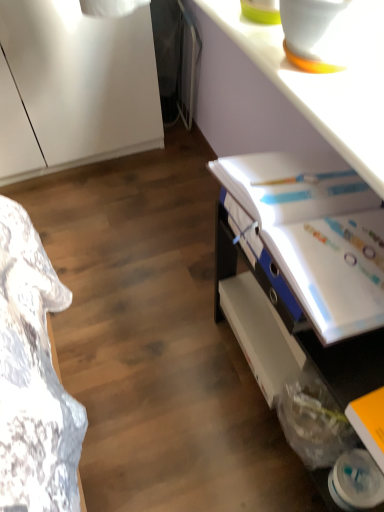
Question: From a real-world perspective, is white glossy binder at upper right, which is counted as the 2th book, starting from the front, physically below white glossy desk at lower right?

Choices:
 (A) no
 (B) yes

Answer: (A)

Question: Does white glossy binder at upper right, the first book in the top-to-bottom sequence, appear on the left side of white glossy desk at lower right?

Choices:
 (A) no
 (B) yes

Answer: (B)

Question: Can you confirm if white glossy binder at upper right, arranged as the first book when viewed from the back, is wider than white glossy desk at lower right?

Choices:
 (A) no
 (B) yes

Answer: (A)

Question: Considering the relative sizes of white glossy binder at upper right, the first book in the top-to-bottom sequence, and white glossy desk at lower right in the image provided, is white glossy binder at upper right, the first book in the top-to-bottom sequence, taller than white glossy desk at lower right?

Choices:
 (A) no
 (B) yes

Answer: (A)

Question: Is white glossy binder at upper right, which is counted as the 2th book, starting from the front, positioned in front of white glossy desk at lower right?

Choices:
 (A) yes
 (B) no

Answer: (B)

Question: From the image's perspective, is white plastic shelf at lower right located above or below white glossy binder at upper right, arranged as the first book when viewed from the back?

Choices:
 (A) above
 (B) below

Answer: (B)

Question: Relative to white glossy binder at upper right, which is counted as the 2th book, starting from the front, is white plastic shelf at lower right in front or behind?

Choices:
 (A) front
 (B) behind

Answer: (B)

Question: From a real-world perspective, is white plastic shelf at lower right physically located above or below white glossy binder at upper right, the first book in the top-to-bottom sequence?

Choices:
 (A) below
 (B) above

Answer: (A)

Question: Looking at the image, does white plastic shelf at lower right seem bigger or smaller compared to white glossy binder at upper right, marked as the second book in a bottom-to-top arrangement?

Choices:
 (A) big
 (B) small

Answer: (B)

Question: In terms of width, does white plastic shelf at lower right look wider or thinner when compared to yellow matte book at lower right, placed as the second book when sorted from back to front?

Choices:
 (A) wide
 (B) thin

Answer: (A)

Question: Considering the positions of white plastic shelf at lower right and yellow matte book at lower right, which appears as the 1th book when viewed from the front, in the image, is white plastic shelf at lower right taller or shorter than yellow matte book at lower right, which appears as the 1th book when viewed from the front,?

Choices:
 (A) tall
 (B) short

Answer: (A)

Question: In terms of size, does white plastic shelf at lower right appear bigger or smaller than yellow matte book at lower right, placed as the second book when sorted from top to bottom?

Choices:
 (A) big
 (B) small

Answer: (A)

Question: Is point (273, 344) positioned closer to the camera than point (369, 412)?

Choices:
 (A) closer
 (B) farther

Answer: (B)

Question: From the image's perspective, is yellow matte book at lower right, placed as the second book when sorted from top to bottom, located above or below white glossy binder at upper right, marked as the second book in a bottom-to-top arrangement?

Choices:
 (A) above
 (B) below

Answer: (B)

Question: Relative to white glossy binder at upper right, marked as the second book in a bottom-to-top arrangement, is yellow matte book at lower right, placed as the second book when sorted from back to front, in front or behind?

Choices:
 (A) front
 (B) behind

Answer: (A)